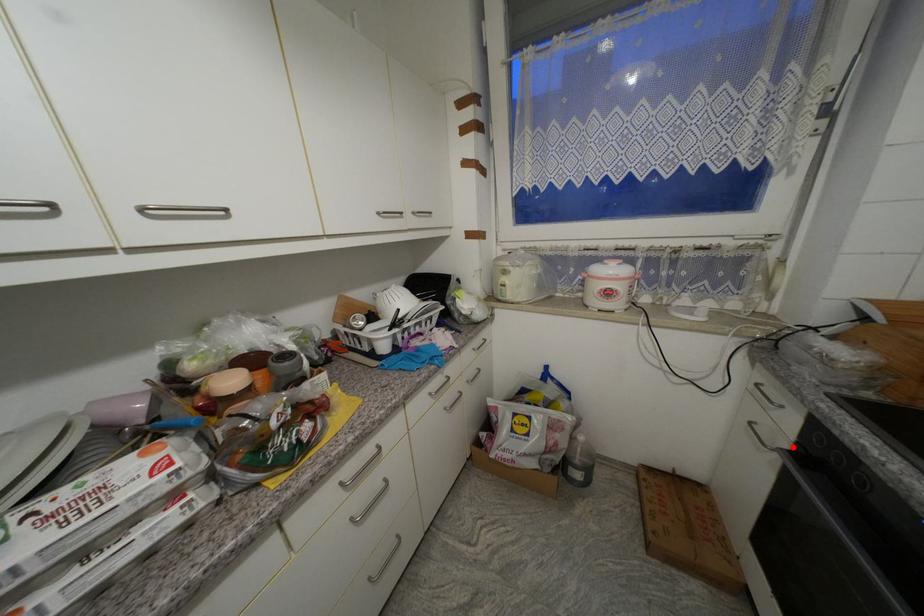
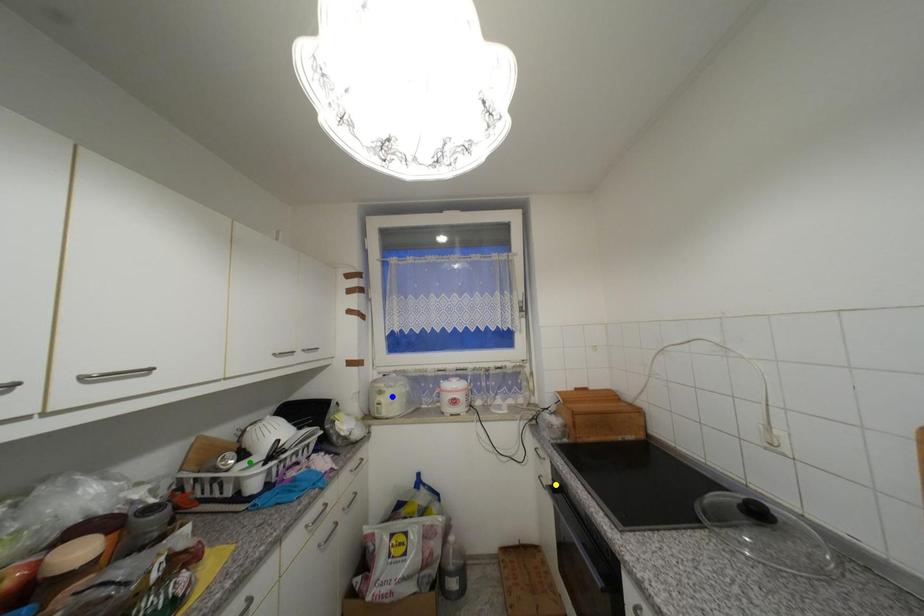
Question: I am providing you with two images of the same scene from different viewpoints. A red point is marked on the first image. You are given multiple points on the second image. In image 2, which mark is for the same physical point as the one in image 1?

Choices:
 (A) yellow point
 (B) blue point
 (C) green point

Answer: (A)